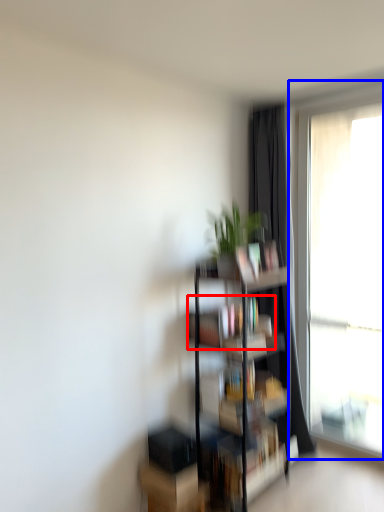
Question: Which of the following is the closest to the observer, book (highlighted by a red box) or window (highlighted by a blue box)?

Choices:
 (A) book
 (B) window

Answer: (A)